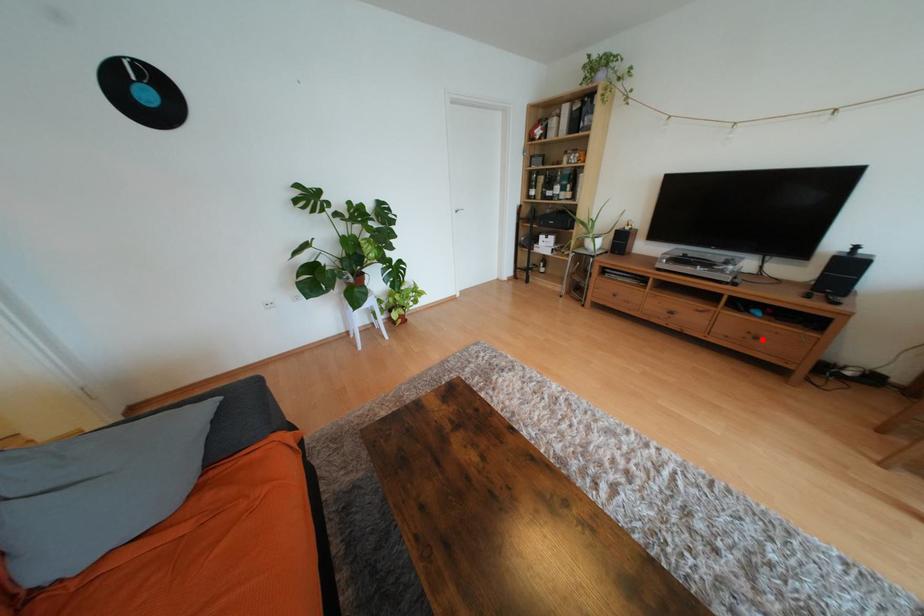
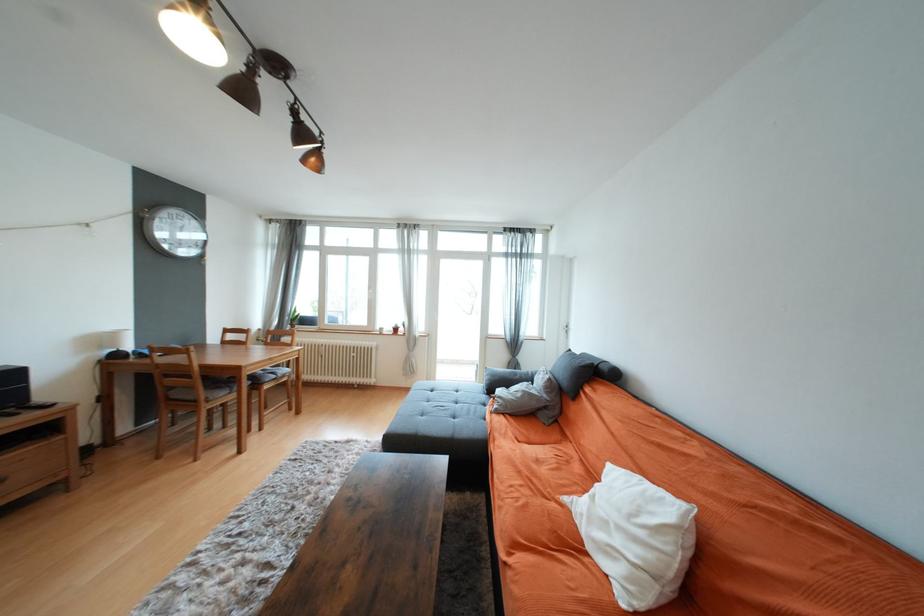
Question: I am providing you with two images of the same scene from different viewpoints. Given a red point in image1, look at the same physical point in image2. Is it:

Choices:
 (A) Closer to the viewpoint
 (B) Farther from the viewpoint

Answer: (A)